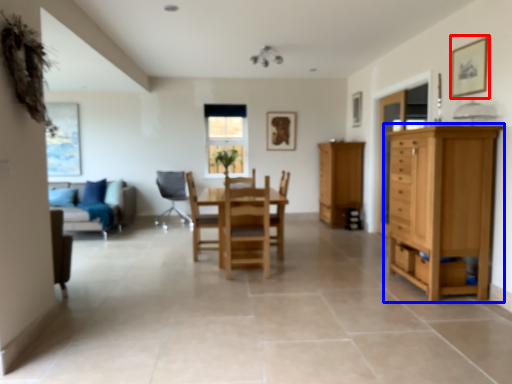
Question: Among these objects, which one is farthest to the camera, picture frame (highlighted by a red box) or cupboard (highlighted by a blue box)?

Choices:
 (A) picture frame
 (B) cupboard

Answer: (A)